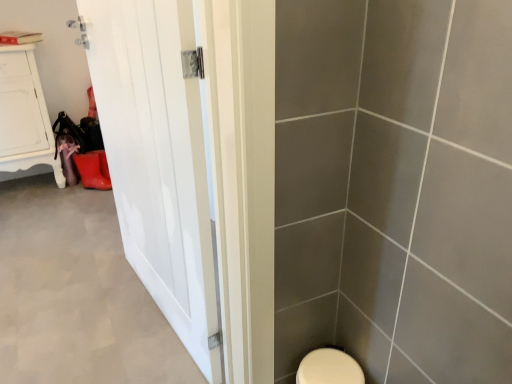
Image resolution: width=512 pixels, height=384 pixels. I want to click on free space in front of white glossy door at left, so click(x=139, y=349).